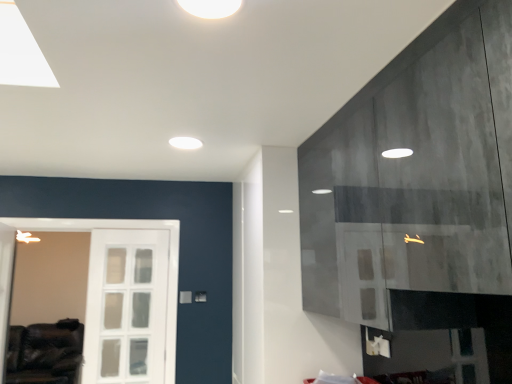
Question: Is white matte light fixture at upper center, which ranks as the second lighting in bottom-to-top order, in contact with white matte ceiling light at upper center, the 2th lighting positioned from the right?

Choices:
 (A) no
 (B) yes

Answer: (A)

Question: Can you confirm if white matte light fixture at upper center, which appears as the second lighting when viewed from the back, is smaller than white matte ceiling light at upper center, placed as the 1th lighting when sorted from left to right?

Choices:
 (A) yes
 (B) no

Answer: (A)

Question: Does white matte light fixture at upper center, acting as the first lighting starting from the top, have a larger size compared to white matte ceiling light at upper center, positioned as the 2th lighting in front-to-back order?

Choices:
 (A) no
 (B) yes

Answer: (A)

Question: Does white matte light fixture at upper center, which ranks as the second lighting in bottom-to-top order, have a lesser height compared to white matte ceiling light at upper center, placed as the 1th lighting when sorted from left to right?

Choices:
 (A) yes
 (B) no

Answer: (B)

Question: From the image's perspective, is white matte light fixture at upper center, which appears as the second lighting when viewed from the back, over white matte ceiling light at upper center, the 1th lighting in the back-to-front sequence?

Choices:
 (A) no
 (B) yes

Answer: (B)

Question: Relative to leather couch at lower left, is white matte ceiling light at upper center, positioned as the 2th lighting in front-to-back order, in front or behind?

Choices:
 (A) behind
 (B) front

Answer: (B)

Question: From a real-world perspective, is white matte ceiling light at upper center, placed as the 1th lighting when sorted from left to right, positioned above or below leather couch at lower left?

Choices:
 (A) above
 (B) below

Answer: (A)

Question: In terms of width, does white matte ceiling light at upper center, the 2th lighting positioned from the right, look wider or thinner when compared to leather couch at lower left?

Choices:
 (A) thin
 (B) wide

Answer: (A)

Question: Is white matte ceiling light at upper center, the 1th lighting in the back-to-front sequence, inside the boundaries of leather couch at lower left, or outside?

Choices:
 (A) outside
 (B) inside

Answer: (A)

Question: Relative to leather couch at lower left, is white matte light fixture at upper center, the 1th lighting positioned from the right, in front or behind?

Choices:
 (A) behind
 (B) front

Answer: (B)

Question: Considering the positions of white matte light fixture at upper center, the 1th lighting positioned from the right, and leather couch at lower left in the image, is white matte light fixture at upper center, the 1th lighting positioned from the right, taller or shorter than leather couch at lower left?

Choices:
 (A) short
 (B) tall

Answer: (A)

Question: Choose the correct answer: Is white matte light fixture at upper center, the 1th lighting positioned from the right, inside leather couch at lower left or outside it?

Choices:
 (A) inside
 (B) outside

Answer: (B)

Question: Is white matte light fixture at upper center, the 2th lighting when ordered from left to right, wider or thinner than leather couch at lower left?

Choices:
 (A) thin
 (B) wide

Answer: (A)

Question: Is white matte ceiling light at upper center, which ranks as the 1th lighting in bottom-to-top order, inside the boundaries of white matte light fixture at upper center, which appears as the second lighting when viewed from the back, or outside?

Choices:
 (A) inside
 (B) outside

Answer: (B)

Question: Is point (172, 137) closer or farther from the camera than point (239, 3)?

Choices:
 (A) closer
 (B) farther

Answer: (B)